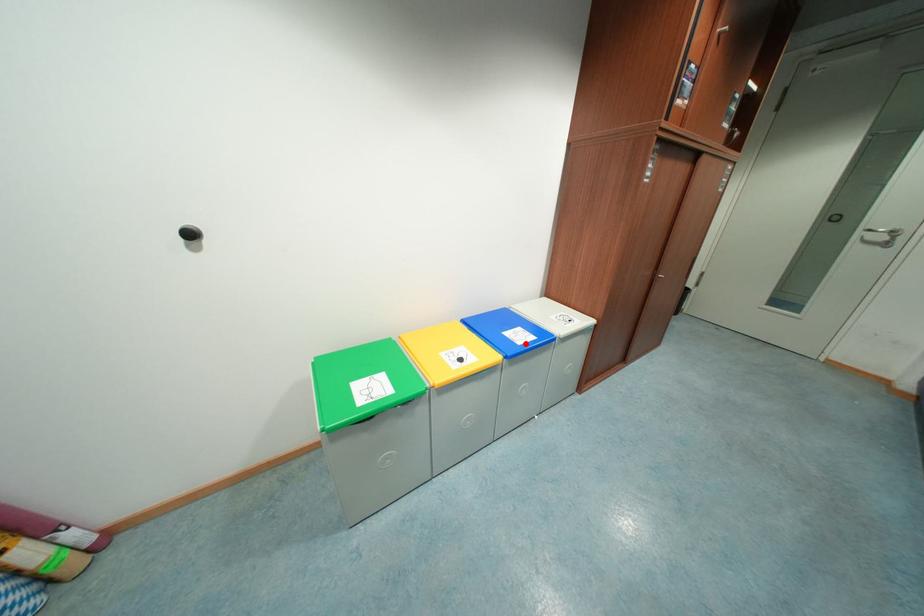
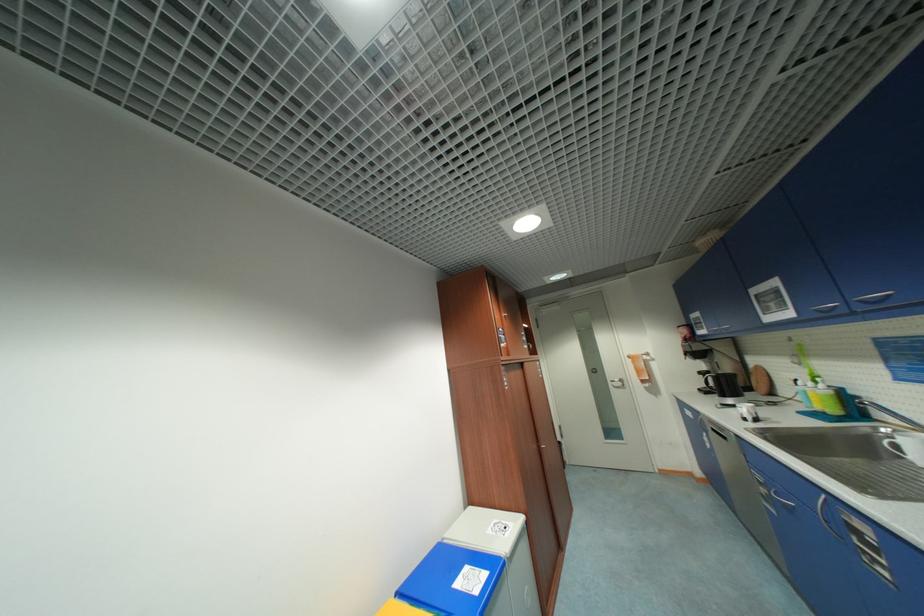
Where in the second image is the point corresponding to the highlighted location from the first image?

(482, 593)